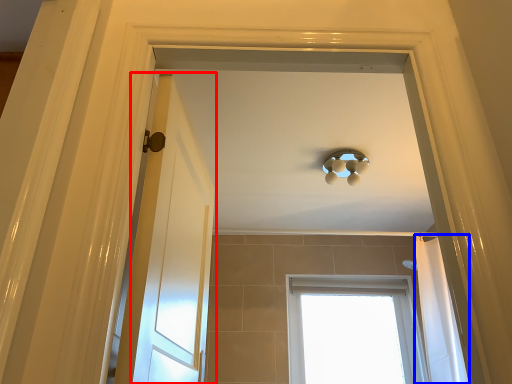
Question: Which point is closer to the camera, door (highlighted by a red box) or shower curtain (highlighted by a blue box)?

Choices:
 (A) door
 (B) shower curtain

Answer: (A)